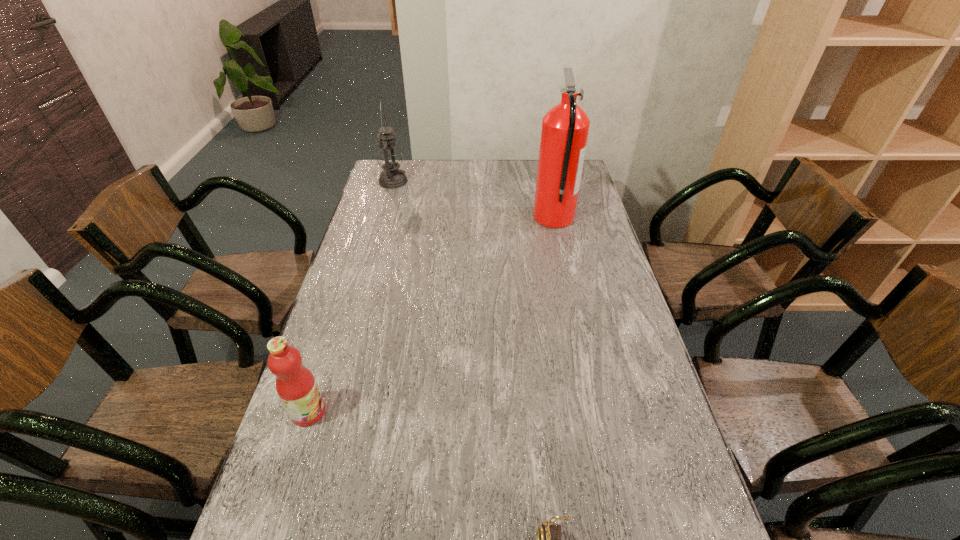
Identify the location of fire extinguisher. (565, 127).

Find the location of a particular element. the second farthest object is located at coordinates (565, 127).

Image resolution: width=960 pixels, height=540 pixels. Find the location of `oil lamp`. oil lamp is located at coordinates (389, 157).

I want to click on the farthest object, so click(x=389, y=157).

Image resolution: width=960 pixels, height=540 pixels. Find the location of `fruit juice`. fruit juice is located at coordinates (296, 386).

Find the location of a particular element. the second nearest object is located at coordinates (296, 386).

This screenshot has height=540, width=960. In order to click on blank space located 0.180m at the nozzle of the fire extinguisher in this screenshot , I will do [487, 218].

You are a GUI agent. You are given a task and a screenshot of the screen. Output one action in this format:
    pyautogui.click(x=<x>, y=<y>)
    Task: Click on the free location located at the nozzle of the fire extinguisher
    The width and height of the screenshot is (960, 540).
    Given the screenshot: What is the action you would take?
    pyautogui.click(x=476, y=218)

This screenshot has height=540, width=960. I want to click on free space located 0.210m at the nozzle of the fire extinguisher, so click(479, 218).

Locate an element on the screen. Image resolution: width=960 pixels, height=540 pixels. vacant space located 0.100m on the front of the farthest object is located at coordinates (387, 203).